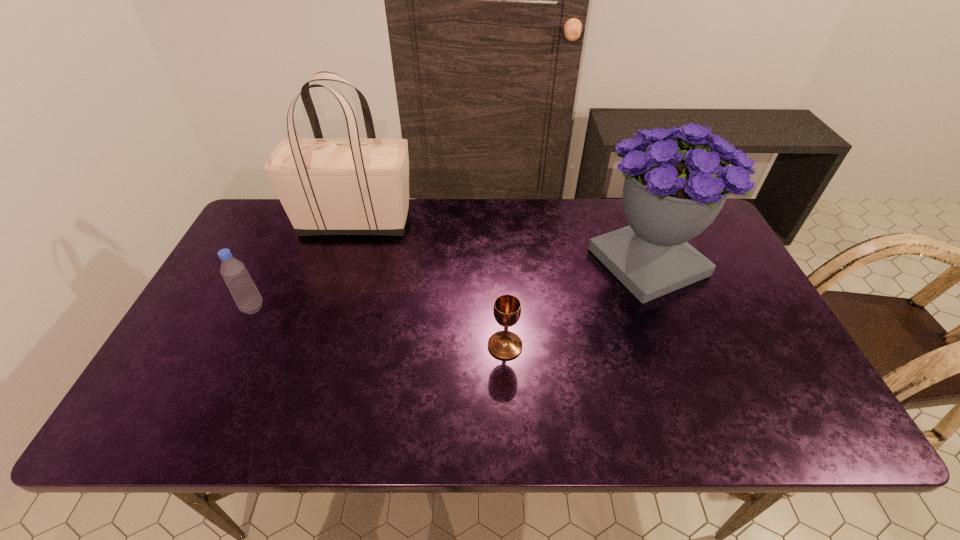
What are the coordinates of `shopping bag` in the screenshot? It's located at (327, 186).

Find the location of a particular element. This screenshot has width=960, height=540. the rightmost object is located at coordinates (671, 194).

Locate an element on the screen. bottle is located at coordinates (239, 282).

Locate an element on the screen. the shortest object is located at coordinates (505, 345).

Identify the location of the nearest object. This screenshot has width=960, height=540. 505,345.

This screenshot has height=540, width=960. In order to click on vacant area situated with handles facing forward on the shopping bag in this screenshot , I will do `click(526, 222)`.

You are a GUI agent. You are given a task and a screenshot of the screen. Output one action in this format:
    pyautogui.click(x=<x>, y=<y>)
    Task: Click on the free location located 0.180m on the left of the bouquet
    
    Given the screenshot: What is the action you would take?
    pyautogui.click(x=530, y=262)

At what (x,y) coordinates should I click in order to perform the action: click on vacant space located 0.280m on the back of the third tallest object. Please return your answer as a coordinate pair (x, y). The width and height of the screenshot is (960, 540). Looking at the image, I should click on (289, 233).

At what (x,y) coordinates should I click in order to perform the action: click on vacant space located on the right of the chalice. Please return your answer as a coordinate pair (x, y). Looking at the image, I should click on (599, 346).

This screenshot has height=540, width=960. I want to click on shopping bag that is at the far edge, so click(327, 186).